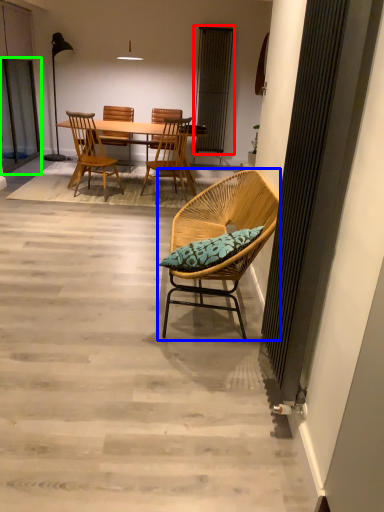
Question: Which is nearer to the curtain (highlighted by a red box)? chair (highlighted by a blue box) or screen door (highlighted by a green box).

Choices:
 (A) chair
 (B) screen door

Answer: (B)